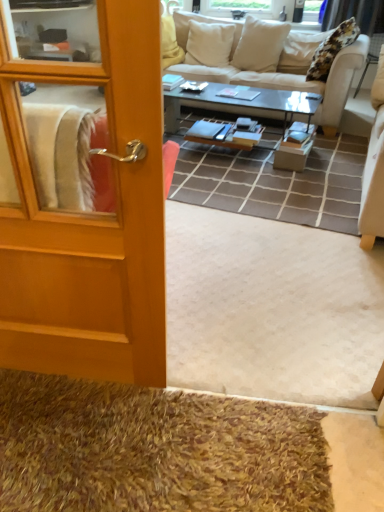
Locate an element on the screen. free space in front of black glass coffee table at center is located at coordinates (243, 188).